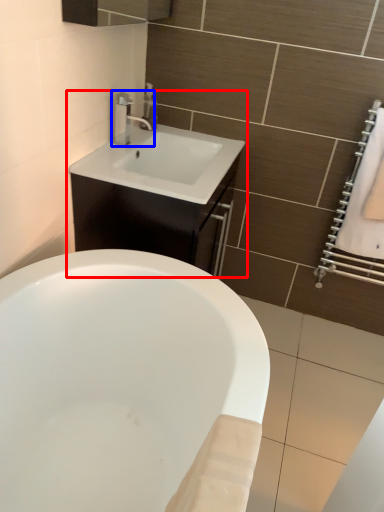
Question: Among these objects, which one is farthest to the camera, bathroom cabinet (highlighted by a red box) or tap (highlighted by a blue box)?

Choices:
 (A) bathroom cabinet
 (B) tap

Answer: (B)